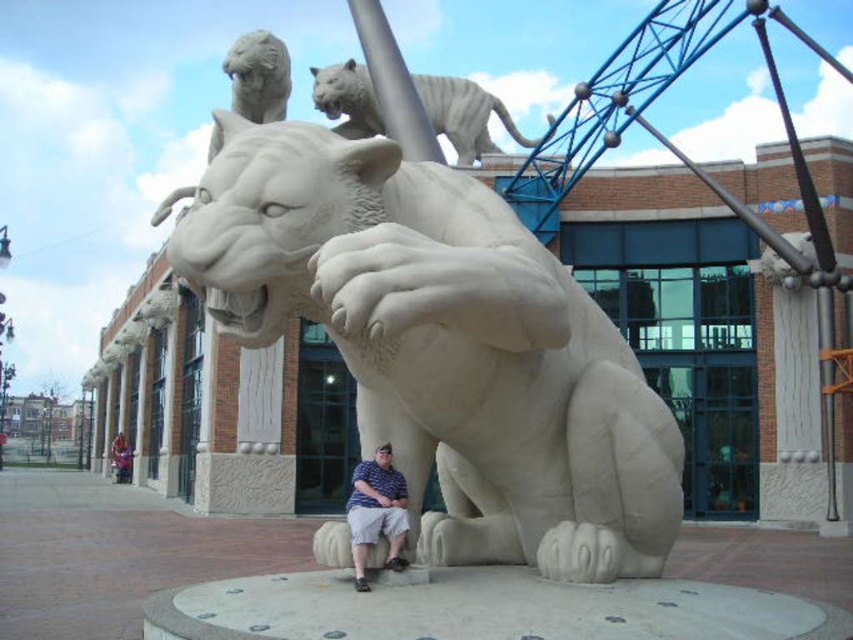
Question: Can you confirm if white stone lion at center is positioned above striped shirt at center?

Choices:
 (A) no
 (B) yes

Answer: (B)

Question: Which of the following is the farthest from the observer?

Choices:
 (A) white stone lion at center
 (B) striped shirt at center
 (C) white marble tiger at upper center

Answer: (C)

Question: Which point is farther to the camera?

Choices:
 (A) click(660, 467)
 (B) click(463, 161)
 (C) click(373, 481)

Answer: (B)

Question: Can you confirm if white marble tiger at upper center is smaller than striped shirt at center?

Choices:
 (A) yes
 (B) no

Answer: (B)

Question: Does white stone lion at center have a lesser width compared to striped shirt at center?

Choices:
 (A) no
 (B) yes

Answer: (A)

Question: Among these objects, which one is nearest to the camera?

Choices:
 (A) striped shirt at center
 (B) white stone lion at center

Answer: (B)